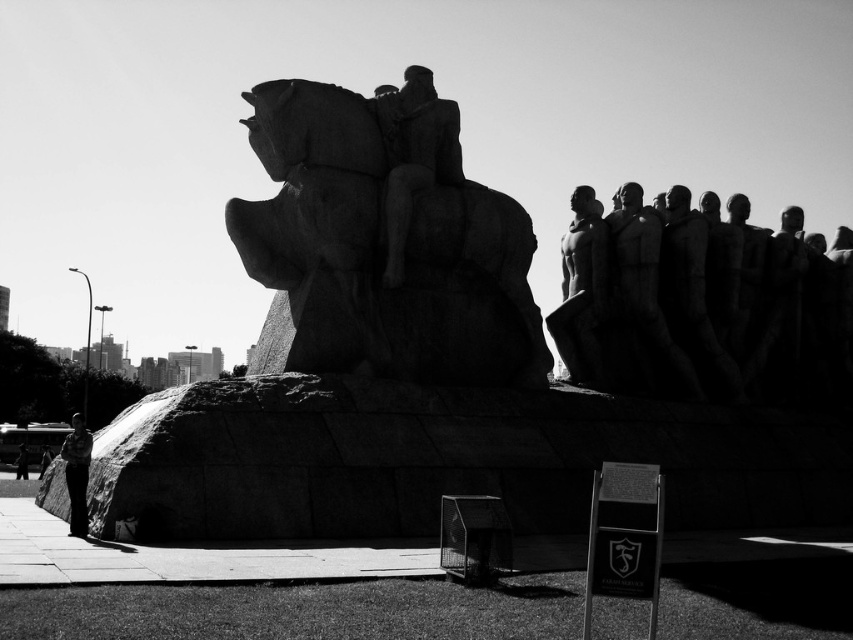
In the scene shown: Does granite statue at center have a lesser height compared to smooth stone statue at center?

In fact, granite statue at center may be taller than smooth stone statue at center.

Between point (502, 349) and point (416, 173), which one is positioned in front?

Point (416, 173)

Between point (403, 323) and point (387, 256), which one is positioned in front?

Positioned in front is point (387, 256).

The width and height of the screenshot is (853, 640). Identify the location of granite statue at center. (384, 241).

Which of these two, smooth stone figures at center or smooth stone statue at center, stands taller?

With more height is smooth stone figures at center.

Does smooth stone figures at center have a greater width compared to smooth stone statue at center?

Indeed, smooth stone figures at center has a greater width compared to smooth stone statue at center.

Is point (711, 308) more distant than point (428, 74)?

Yes, it is.

This screenshot has width=853, height=640. In order to click on smooth stone figures at center in this screenshot , I will do `click(701, 304)`.

Is granite statue at center smaller than camouflage shirt at lower left?

No.

Between granite statue at center and camouflage shirt at lower left, which one has less height?

camouflage shirt at lower left is shorter.

Is point (412, 266) behind point (67, 448)?

That is True.

I want to click on granite statue at center, so click(384, 241).